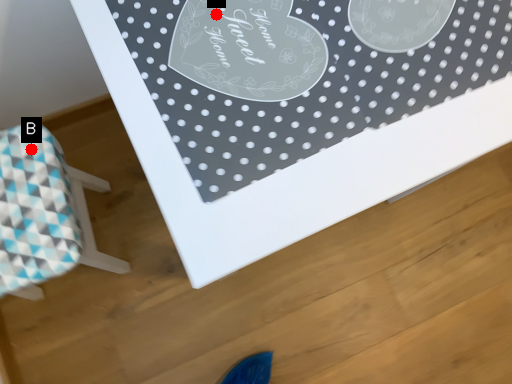
Question: Two points are circled on the image, labeled by A and B beside each circle. Which point is farther from the camera taking this photo?

Choices:
 (A) A is further
 (B) B is further

Answer: (B)